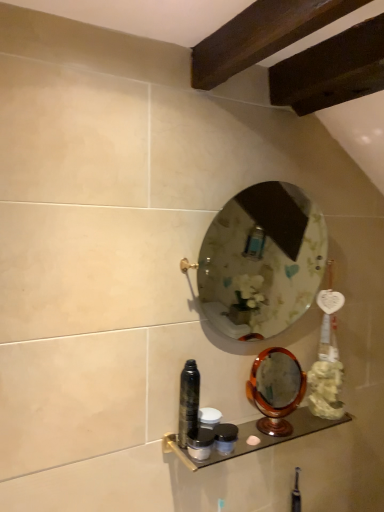
At what (x,y) coordinates should I click in order to perform the action: click on vacant area located to the right-hand side of matte black container at lower center, which is counted as the 2th toiletry, starting from the top. Please return your answer as a coordinate pair (x, y). Looking at the image, I should click on (248, 432).